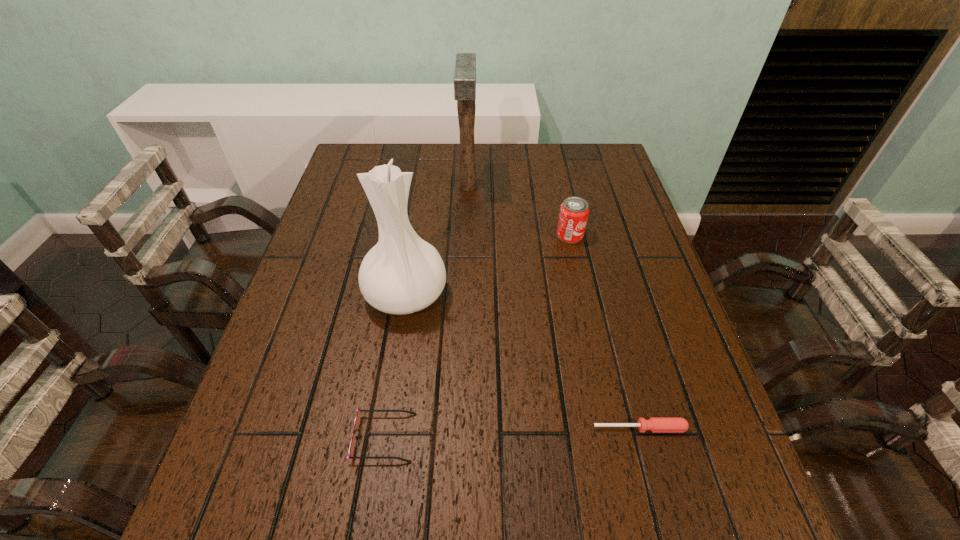
You are a GUI agent. You are given a task and a screenshot of the screen. Output one action in this format:
    pyautogui.click(x=<x>, y=<y>)
    Task: Click on the object that can be found as the third closest to the third object from left to right
    
    Given the screenshot: What is the action you would take?
    point(357,420)

The width and height of the screenshot is (960, 540). In order to click on object that stands as the second closest to the second shortest object in this screenshot , I will do `click(655, 424)`.

Locate an element on the screen. This screenshot has width=960, height=540. free spot that satisfies the following two spatial constraints: 1. on the back side of the vase; 2. on the right side of the mallet is located at coordinates (422, 186).

Image resolution: width=960 pixels, height=540 pixels. In order to click on vacant region that satisfies the following two spatial constraints: 1. on the back side of the vase; 2. on the right side of the farthest object in this screenshot , I will do `click(422, 186)`.